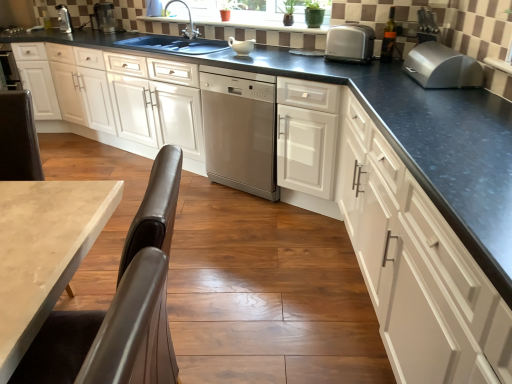
Question: Visually, is green matte plant at upper center positioned to the left or to the right of silver metallic breadbox at upper right, positioned as the 2th kitchen appliance in back-to-front order?

Choices:
 (A) left
 (B) right

Answer: (A)

Question: Does point (300, 23) appear closer or farther from the camera than point (445, 64)?

Choices:
 (A) farther
 (B) closer

Answer: (A)

Question: Which of these objects is positioned farthest from the silver metallic faucet at upper center?

Choices:
 (A) white glossy cabinet at center, which is counted as the 3th cabinetry, starting from the right
 (B) green matte plant at upper center
 (C) metal toaster at upper left, acting as the first appliance starting from the left
 (D) stainless steel dishwasher at center
 (E) metallic silver blender at upper left, which appears as the 1th appliance when viewed from the right

Answer: (C)

Question: Based on their relative distances, which object is farther from the white glossy cabinet at center, arranged as the 1th cabinetry when viewed from the left?

Choices:
 (A) silver metallic faucet at upper center
 (B) satin silver toaster at upper right, which is the first kitchen appliance from left to right
 (C) white glossy cabinet at center, arranged as the 2th cabinetry when viewed from the left
 (D) green matte plant at upper center
 (E) stainless steel dishwasher at center

Answer: (B)